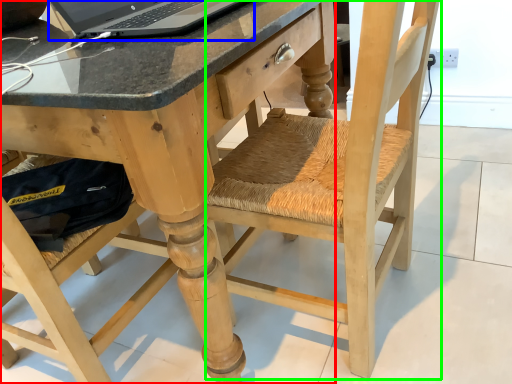
Question: Based on their relative distances, which object is farther from desk (highlighted by a red box)? Choose from laptop (highlighted by a blue box) and swivel chair (highlighted by a green box).

Choices:
 (A) laptop
 (B) swivel chair

Answer: (B)